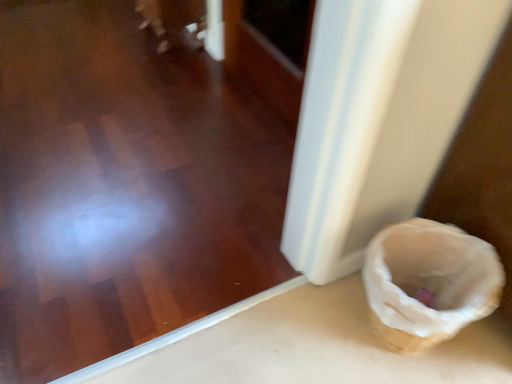
This screenshot has width=512, height=384. What do you see at coordinates (428, 283) in the screenshot?
I see `white plastic bag at lower right` at bounding box center [428, 283].

Where is `white plastic bag at lower right`? white plastic bag at lower right is located at coordinates (428, 283).

Based on the photo, measure the distance between white plastic bag at lower right and camera.

The distance of white plastic bag at lower right from camera is 88.94 centimeters.

Where is `white plastic bag at lower right`? white plastic bag at lower right is located at coordinates (428, 283).